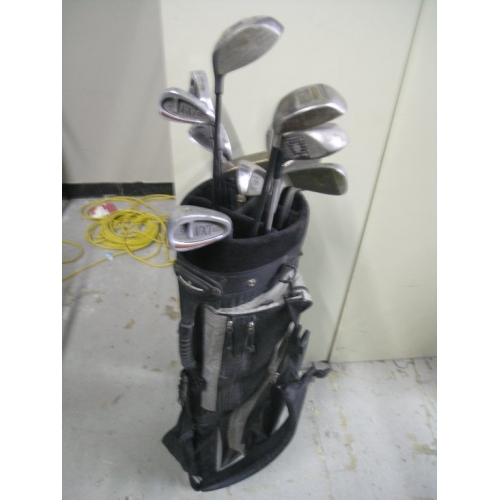
I want to click on stains, so click(x=351, y=463), click(x=426, y=451).